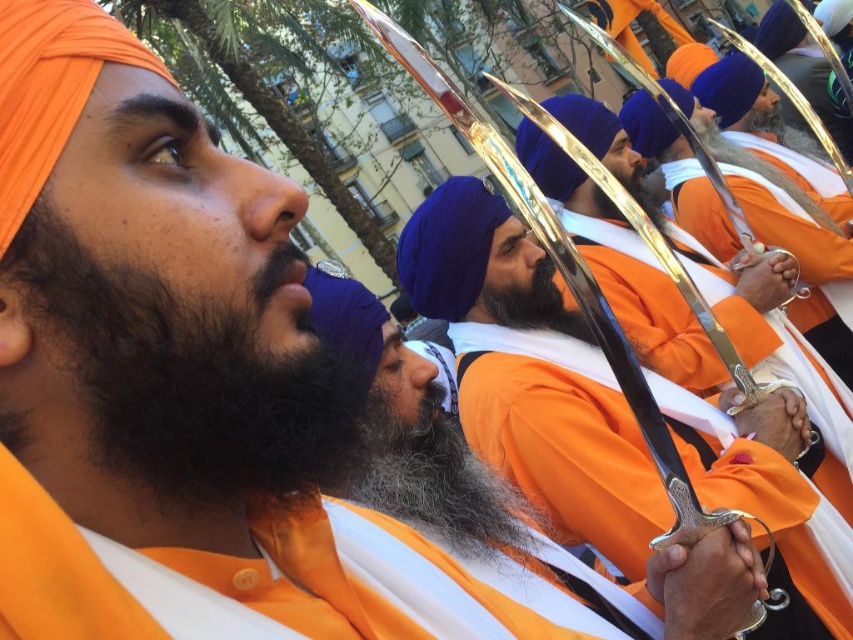
Question: Does shiny silver sword at center appear on the left side of dark brown curly beard at left?

Choices:
 (A) yes
 (B) no

Answer: (B)

Question: Which object appears closest to the camera in this image?

Choices:
 (A) dark brown curly beard at left
 (B) shiny silver sword at center

Answer: (A)

Question: Is shiny silver sword at center below dark brown curly beard at left?

Choices:
 (A) no
 (B) yes

Answer: (B)

Question: Can you confirm if shiny silver sword at center is positioned below dark brown curly beard at left?

Choices:
 (A) yes
 (B) no

Answer: (A)

Question: Which point is closer to the camera taking this photo?

Choices:
 (A) (326, 438)
 (B) (619, 460)

Answer: (A)